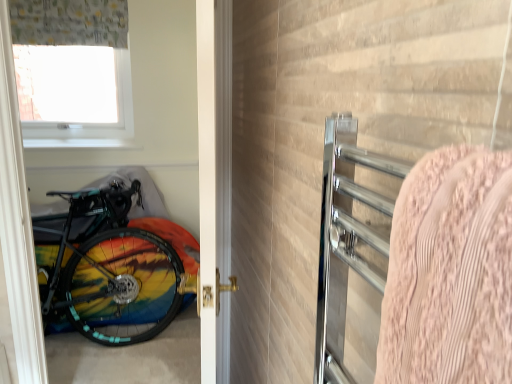
Question: Does transparent plastic window screen at upper left appear on the left side of rainbow painted bicycle at left?

Choices:
 (A) yes
 (B) no

Answer: (A)

Question: Can you confirm if transparent plastic window screen at upper left is shorter than rainbow painted bicycle at left?

Choices:
 (A) yes
 (B) no

Answer: (A)

Question: Would you say transparent plastic window screen at upper left contains rainbow painted bicycle at left?

Choices:
 (A) yes
 (B) no

Answer: (B)

Question: Is transparent plastic window screen at upper left further to camera compared to rainbow painted bicycle at left?

Choices:
 (A) yes
 (B) no

Answer: (A)

Question: Is transparent plastic window screen at upper left positioned beyond the bounds of rainbow painted bicycle at left?

Choices:
 (A) yes
 (B) no

Answer: (A)

Question: From the image's perspective, is transparent plastic window screen at upper left located above rainbow painted bicycle at left?

Choices:
 (A) no
 (B) yes

Answer: (B)

Question: Considering the relative sizes of rainbow painted bicycle at left and white glossy door at center in the image provided, is rainbow painted bicycle at left smaller than white glossy door at center?

Choices:
 (A) yes
 (B) no

Answer: (A)

Question: Would you say rainbow painted bicycle at left is a long distance from white glossy door at center?

Choices:
 (A) yes
 (B) no

Answer: (A)

Question: From a real-world perspective, is rainbow painted bicycle at left beneath white glossy door at center?

Choices:
 (A) yes
 (B) no

Answer: (A)

Question: From a real-world perspective, is rainbow painted bicycle at left over white glossy door at center?

Choices:
 (A) no
 (B) yes

Answer: (A)

Question: From the image's perspective, does rainbow painted bicycle at left appear lower than white glossy door at center?

Choices:
 (A) no
 (B) yes

Answer: (B)

Question: Considering the relative sizes of rainbow painted bicycle at left and white glossy door at center in the image provided, is rainbow painted bicycle at left shorter than white glossy door at center?

Choices:
 (A) no
 (B) yes

Answer: (B)

Question: Is white glossy door at center outside pink textured towel at right?

Choices:
 (A) yes
 (B) no

Answer: (A)